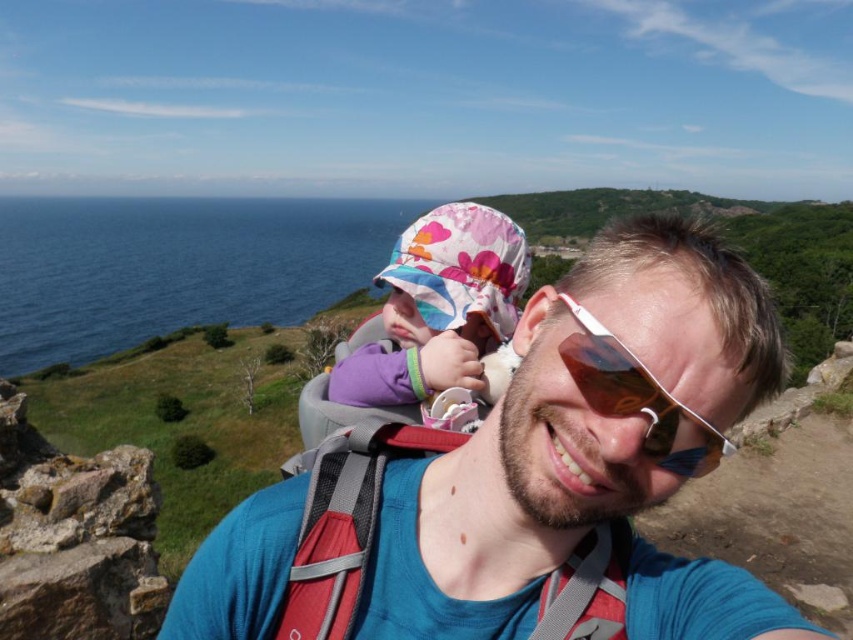
Between blue fabric shirt at center and sunglasses at center, which one has less height?

sunglasses at center

You are a GUI agent. You are given a task and a screenshot of the screen. Output one action in this format:
    pyautogui.click(x=<x>, y=<y>)
    Task: Click on the blue fabric shirt at center
    The image size is (853, 640).
    Given the screenshot: What is the action you would take?
    pyautogui.click(x=575, y=429)

The width and height of the screenshot is (853, 640). Describe the element at coordinates (575, 429) in the screenshot. I see `blue fabric shirt at center` at that location.

The height and width of the screenshot is (640, 853). Find the location of `blue fabric shirt at center`. blue fabric shirt at center is located at coordinates (575, 429).

Who is more distant from viewer, (50, 588) or (664, 465)?

The point (50, 588) is behind.

Which is in front, point (109, 625) or point (695, 426)?

Point (695, 426) is more forward.

Where is `brown stone cliff at lower left`? The height and width of the screenshot is (640, 853). brown stone cliff at lower left is located at coordinates (74, 538).

Can you confirm if blue fabric shirt at center is positioned below floral fabric hat at center?

Yes, blue fabric shirt at center is below floral fabric hat at center.

Can you confirm if blue fabric shirt at center is positioned to the right of floral fabric hat at center?

Correct, you'll find blue fabric shirt at center to the right of floral fabric hat at center.

Measure the distance between blue fabric shirt at center and camera.

blue fabric shirt at center and camera are 36.80 inches apart.

This screenshot has width=853, height=640. Find the location of `blue fabric shirt at center`. blue fabric shirt at center is located at coordinates (575, 429).